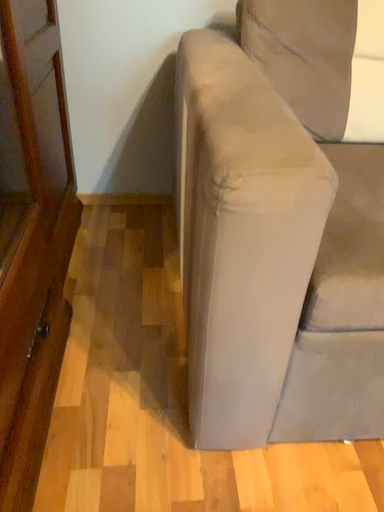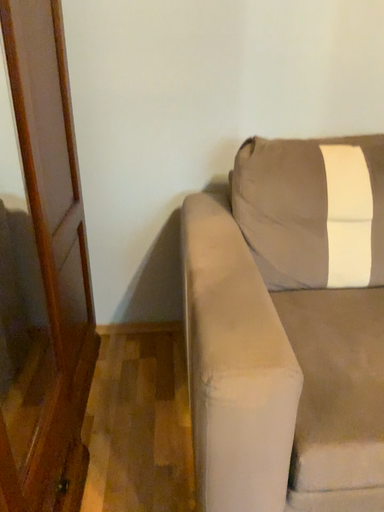
Question: How did the camera likely rotate when shooting the video?

Choices:
 (A) rotated upward
 (B) rotated downward

Answer: (A)